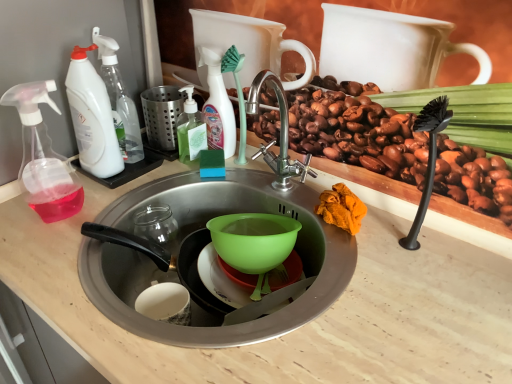
Question: Is white plastic spray bottle at left, placed as the 2th cleaning product when sorted from left to right, shorter than matte stainless steel sink at center?

Choices:
 (A) yes
 (B) no

Answer: (A)

Question: Is white plastic spray bottle at left, the 2th cleaning product in the right-to-left sequence, in front of matte stainless steel sink at center?

Choices:
 (A) yes
 (B) no

Answer: (B)

Question: Can you confirm if white plastic spray bottle at left, placed as the 2th cleaning product when sorted from left to right, is positioned to the right of matte stainless steel sink at center?

Choices:
 (A) no
 (B) yes

Answer: (A)

Question: Does white plastic spray bottle at left, the 2th cleaning product in the right-to-left sequence, have a lesser width compared to matte stainless steel sink at center?

Choices:
 (A) no
 (B) yes

Answer: (B)

Question: Can you confirm if white plastic spray bottle at left, placed as the 2th cleaning product when sorted from left to right, is wider than matte stainless steel sink at center?

Choices:
 (A) no
 (B) yes

Answer: (A)

Question: Is white plastic spray bottle at left, the 2th cleaning product in the right-to-left sequence, smaller than matte stainless steel sink at center?

Choices:
 (A) no
 (B) yes

Answer: (B)

Question: Considering the relative sizes of green plastic brush at upper center and white plastic spray bottle at left, placed as the 2th cleaning product when sorted from left to right, in the image provided, is green plastic brush at upper center taller than white plastic spray bottle at left, placed as the 2th cleaning product when sorted from left to right,?

Choices:
 (A) yes
 (B) no

Answer: (B)

Question: Is green plastic brush at upper center at the left side of white plastic spray bottle at left, placed as the 2th cleaning product when sorted from left to right?

Choices:
 (A) no
 (B) yes

Answer: (A)

Question: Are green plastic brush at upper center and white plastic spray bottle at left, the 2th cleaning product in the right-to-left sequence, beside each other?

Choices:
 (A) yes
 (B) no

Answer: (B)

Question: From the image's perspective, would you say green plastic brush at upper center is shown under white plastic spray bottle at left, the 2th cleaning product in the right-to-left sequence?

Choices:
 (A) no
 (B) yes

Answer: (B)

Question: Is green plastic brush at upper center thinner than white plastic spray bottle at left, the 2th cleaning product in the right-to-left sequence?

Choices:
 (A) no
 (B) yes

Answer: (B)

Question: From a real-world perspective, is green plastic brush at upper center located beneath white plastic spray bottle at left, the 2th cleaning product in the right-to-left sequence?

Choices:
 (A) no
 (B) yes

Answer: (B)

Question: Is white plastic spray bottle at left, the 2th cleaning product in the right-to-left sequence, to the left of translucent plastic spray bottle at upper center, which is counted as the 1th cleaning product, starting from the right, from the viewer's perspective?

Choices:
 (A) no
 (B) yes

Answer: (B)